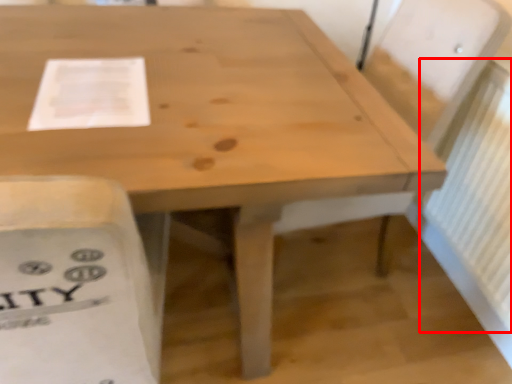
Question: Observing the image, what is the correct spatial positioning of radiator (annotated by the red box) in reference to paper?

Choices:
 (A) left
 (B) right

Answer: (B)